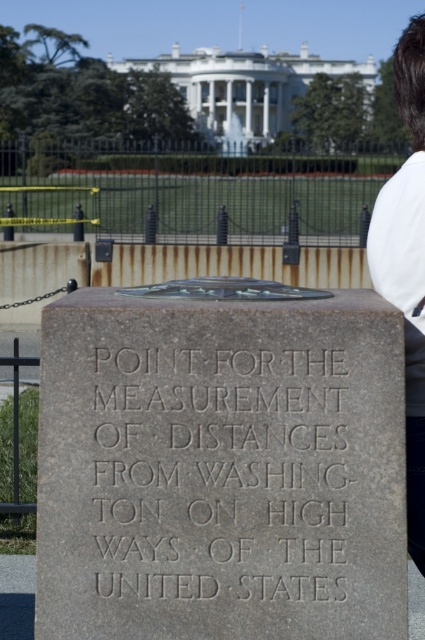
You are a tailor measuring a customer for a custom shirt. You notice the gray stone engraving at center and the white fabric shirt at upper right. Which object has a greater width?

The gray stone engraving at center has a greater width than the white fabric shirt at upper right.

You are a tourist standing in front of the gray stone engraving at center and the white fabric shirt at upper right. Which object is positioned more to the left side of the image?

The gray stone engraving at center is positioned more to the left side of the image than the white fabric shirt at upper right.